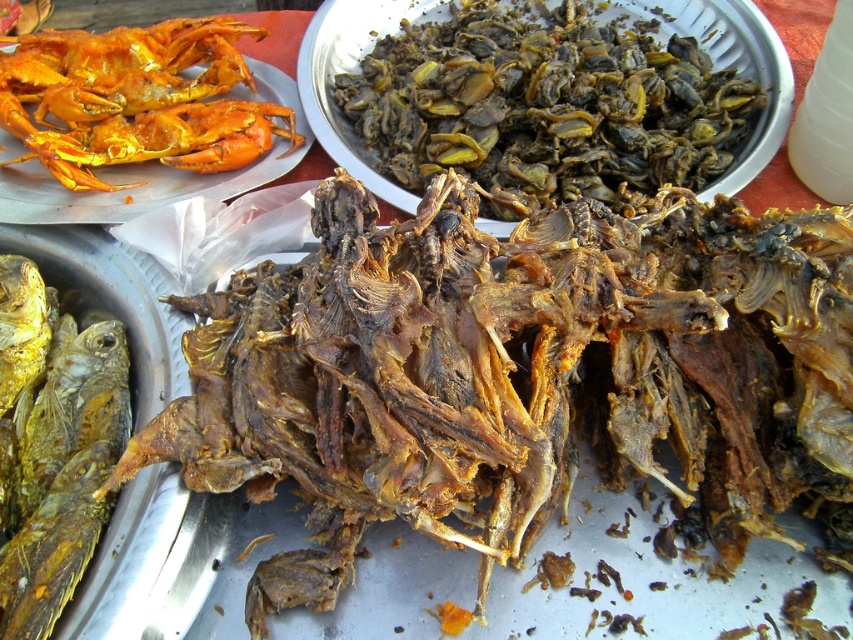
Is brown crispy fish at center closer to the viewer compared to golden crispy crab at upper left?

Yes.

Does brown crispy fish at center have a larger size compared to golden crispy crab at upper left?

Yes, brown crispy fish at center is bigger than golden crispy crab at upper left.

You are a GUI agent. You are given a task and a screenshot of the screen. Output one action in this format:
    pyautogui.click(x=<x>, y=<y>)
    Task: Click on the brown crispy fish at center
    This screenshot has width=853, height=640.
    Given the screenshot: What is the action you would take?
    pyautogui.click(x=514, y=372)

This screenshot has width=853, height=640. Identify the location of brown crispy fish at center. (514, 372).

Who is shorter, brown crispy fish at center or brown crispy insects at upper center?

brown crispy insects at upper center

Is point (842, 308) behind point (560, 182)?

No, (842, 308) is closer to viewer.

At what (x,y) coordinates should I click in order to perform the action: click on brown crispy fish at center. Please return your answer as a coordinate pair (x, y). This screenshot has width=853, height=640. Looking at the image, I should click on (514, 372).

Is point (587, 26) less distant than point (166, 140)?

No, it is behind (166, 140).

At what (x,y) coordinates should I click in order to perform the action: click on brown crispy insects at upper center. Please return your answer as a coordinate pair (x, y). This screenshot has width=853, height=640. Looking at the image, I should click on (546, 102).